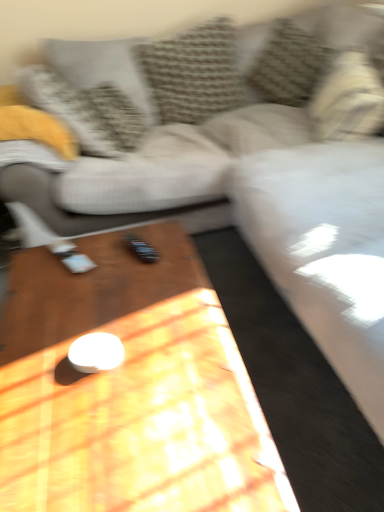
Identify the location of vacant area on top of wooden coffee table at center (from a real-world perspective). (94, 326).